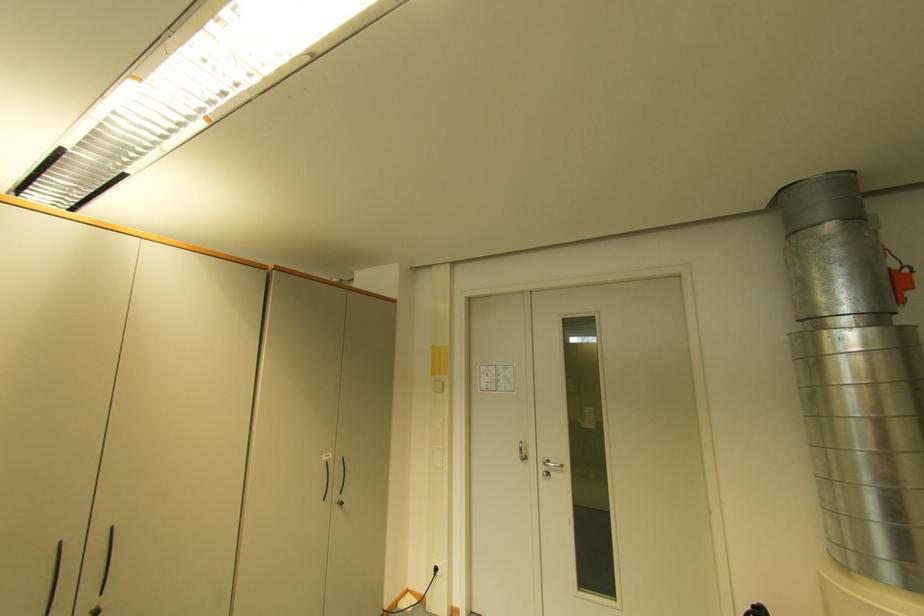
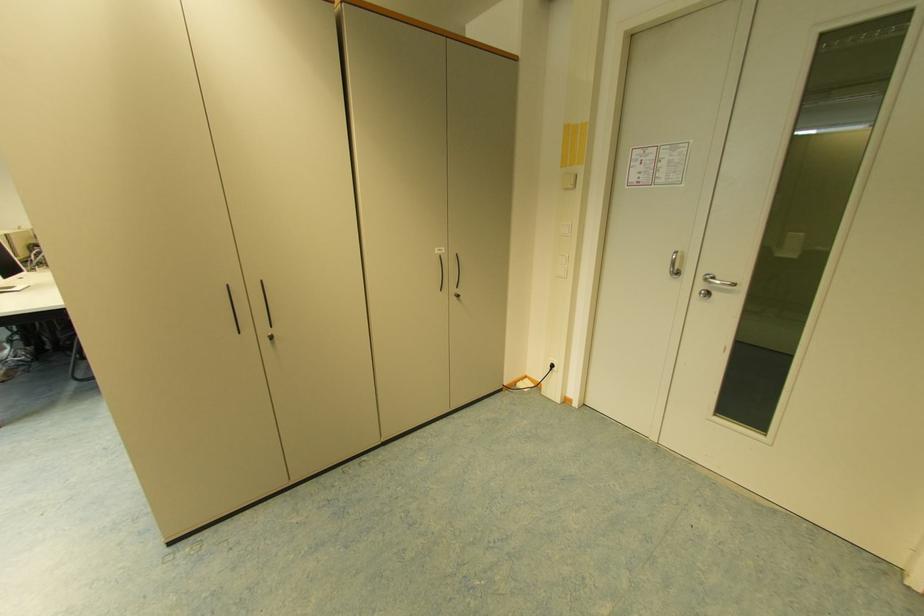
Locate, in the second image, the point that corresponds to (x=327, y=456) in the first image.

(440, 249)